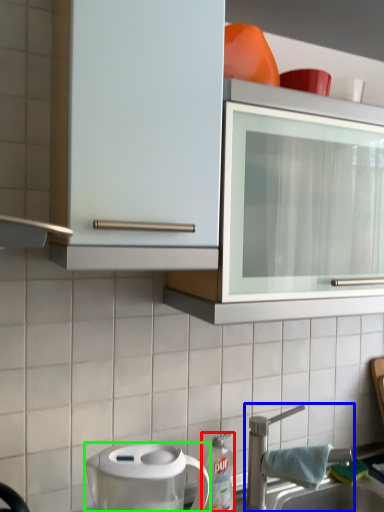
Question: Which object is the farthest from kitchen appliance (highlighted by a red box)? Choose among these: tap (highlighted by a blue box) or home appliance (highlighted by a green box).

Choices:
 (A) tap
 (B) home appliance

Answer: (B)